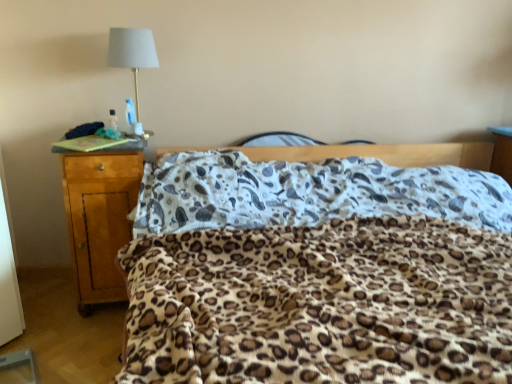
From the picture: Measure the distance between point [492,198] and camera.

Point [492,198] and camera are 6.62 feet apart from each other.

Identify the location of white fabric lampshade at upper left. This screenshot has height=384, width=512. (132, 52).

From a real-world perspective, is leopard print blanket at center positioned above or below light brown wood nightstand at left?

In terms of real-world spatial position, leopard print blanket at center is below light brown wood nightstand at left.

How distant is leopard print blanket at center from light brown wood nightstand at left?

They are 27.84 inches apart.

Does leopard print blanket at center have a larger size compared to light brown wood nightstand at left?

Indeed, leopard print blanket at center has a larger size compared to light brown wood nightstand at left.

Looking at this image, can you tell me how much leopard print blanket at center and light brown wood nightstand at left differ in facing direction?

4.49 degrees.

Is leopard print blanket at center not near white fabric lampshade at upper left?

Indeed, leopard print blanket at center is not near white fabric lampshade at upper left.

Is leopard print blanket at center positioned beyond the bounds of white fabric lampshade at upper left?

Yes, leopard print blanket at center is not within white fabric lampshade at upper left.

From the picture: Is leopard print blanket at center aimed at white fabric lampshade at upper left?

No, leopard print blanket at center is not turned towards white fabric lampshade at upper left.

The height and width of the screenshot is (384, 512). Find the location of `lamp above the leopard print blanket at center (from a real-world perspective)`. lamp above the leopard print blanket at center (from a real-world perspective) is located at coordinates (132, 52).

In the scene shown: Does white fabric lampshade at upper left appear on the right side of light brown wood nightstand at left?

Yes, white fabric lampshade at upper left is to the right of light brown wood nightstand at left.

Considering the positions of objects white fabric lampshade at upper left and light brown wood nightstand at left in the image provided, who is in front, white fabric lampshade at upper left or light brown wood nightstand at left?

light brown wood nightstand at left is in front.

From a real-world perspective, is white fabric lampshade at upper left physically above light brown wood nightstand at left?

Yes, from a real-world perspective, white fabric lampshade at upper left is above light brown wood nightstand at left.

Is light brown wood nightstand at left located outside white fabric lampshade at upper left?

Absolutely, light brown wood nightstand at left is external to white fabric lampshade at upper left.

Which of these two, light brown wood nightstand at left or white fabric lampshade at upper left, is bigger?

With larger size is light brown wood nightstand at left.

Consider the image. How different are the orientations of light brown wood nightstand at left and white fabric lampshade at upper left in degrees?

The facing directions of light brown wood nightstand at left and white fabric lampshade at upper left are 0.000147 degrees apart.

From their relative heights in the image, would you say light brown wood nightstand at left is taller or shorter than white fabric lampshade at upper left?

light brown wood nightstand at left is taller than white fabric lampshade at upper left.

From a real-world perspective, is light brown wood nightstand at left on top of leopard print blanket at center?

Indeed, from a real-world perspective, light brown wood nightstand at left stands above leopard print blanket at center.

Is light brown wood nightstand at left turned away from leopard print blanket at center?

No, light brown wood nightstand at left is not facing away from leopard print blanket at center.

Between light brown wood nightstand at left and leopard print blanket at center, which one has larger width?

With larger width is leopard print blanket at center.

Between light brown wood nightstand at left and leopard print blanket at center, which one has more height?

Standing taller between the two is light brown wood nightstand at left.

How many degrees apart are the facing directions of white fabric lampshade at upper left and leopard print blanket at center?

4.49 degrees separate the facing orientations of white fabric lampshade at upper left and leopard print blanket at center.

Considering the relative sizes of white fabric lampshade at upper left and leopard print blanket at center in the image provided, is white fabric lampshade at upper left bigger than leopard print blanket at center?

No.

Where is `lamp to the left of leopard print blanket at center`? The image size is (512, 384). lamp to the left of leopard print blanket at center is located at coordinates (132, 52).

Does white fabric lampshade at upper left have a greater height compared to leopard print blanket at center?

No.

You are a GUI agent. You are given a task and a screenshot of the screen. Output one action in this format:
    pyautogui.click(x=<x>, y=<y>)
    Task: Click on the nightstand above the leopard print blanket at center (from a real-world perspective)
    The height and width of the screenshot is (384, 512).
    Given the screenshot: What is the action you would take?
    pyautogui.click(x=99, y=219)

The height and width of the screenshot is (384, 512). I want to click on bed on the right of white fabric lampshade at upper left, so click(317, 273).

Considering their positions, is light brown wood nightstand at left positioned further to leopard print blanket at center than white fabric lampshade at upper left?

Based on the image, white fabric lampshade at upper left appears to be further to leopard print blanket at center.

Consider the image. From the image, which object appears to be nearer to leopard print blanket at center, white fabric lampshade at upper left or light brown wood nightstand at left?

Among the two, light brown wood nightstand at left is located nearer to leopard print blanket at center.

From the image, which object appears to be farther from light brown wood nightstand at left, white fabric lampshade at upper left or leopard print blanket at center?

leopard print blanket at center lies further to light brown wood nightstand at left than the other object.

When comparing their distances from light brown wood nightstand at left, does leopard print blanket at center or white fabric lampshade at upper left seem closer?

white fabric lampshade at upper left is positioned closer to the anchor light brown wood nightstand at left.

Which object lies nearer to the anchor point white fabric lampshade at upper left, leopard print blanket at center or light brown wood nightstand at left?

light brown wood nightstand at left is positioned closer to the anchor white fabric lampshade at upper left.

From the image, which object appears to be nearer to white fabric lampshade at upper left, light brown wood nightstand at left or leopard print blanket at center?

The object closer to white fabric lampshade at upper left is light brown wood nightstand at left.

Where is `nightstand between leopard print blanket at center and white fabric lampshade at upper left along the z-axis`? nightstand between leopard print blanket at center and white fabric lampshade at upper left along the z-axis is located at coordinates (99, 219).